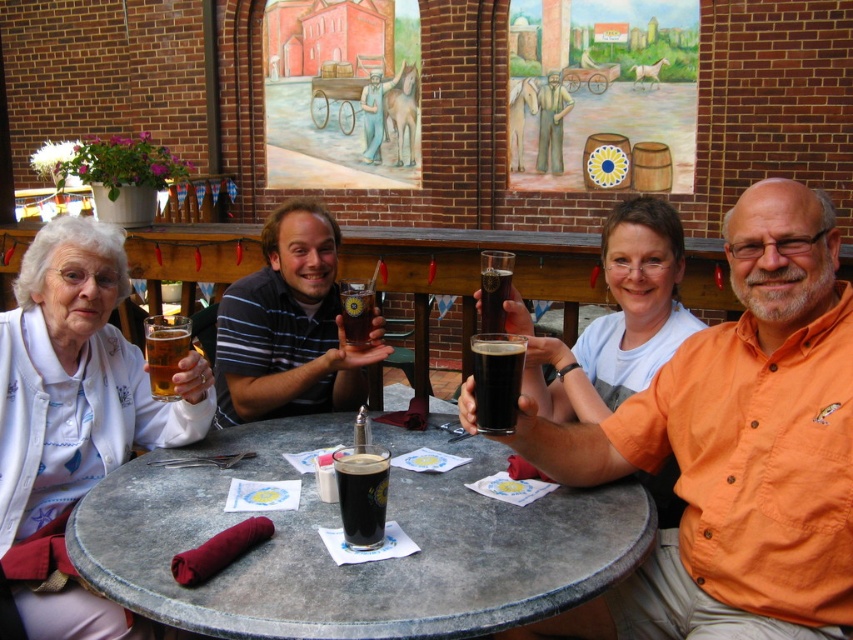
Question: Which object is closer to the camera taking this photo?

Choices:
 (A) striped cotton shirt at center
 (B) orange shirt at center
 (C) dark matte glass at center

Answer: (B)

Question: Can you confirm if smooth stone table at center is bigger than striped cotton shirt at center?

Choices:
 (A) yes
 (B) no

Answer: (A)

Question: Which point is farther to the camera?

Choices:
 (A) (200, 604)
 (B) (349, 324)
 (C) (488, 294)
 (D) (746, 316)

Answer: (B)

Question: Which point is farther from the camera taking this photo?

Choices:
 (A) (485, 392)
 (B) (502, 252)

Answer: (B)

Question: Is matte white blouse at left wider than dark glass at center?

Choices:
 (A) yes
 (B) no

Answer: (A)

Question: Can you confirm if orange shirt at center is positioned below translucent glass beer at lower left?

Choices:
 (A) no
 (B) yes

Answer: (B)